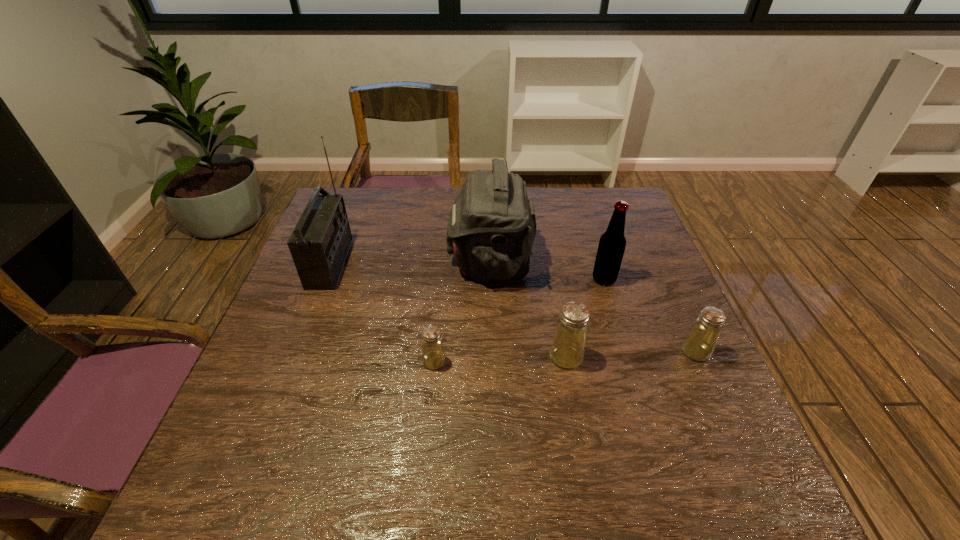
I want to click on beer bottle that is at the right edge, so click(x=612, y=243).

At what (x,y) coordinates should I click in order to perform the action: click on free space at the far edge. Please return your answer as a coordinate pair (x, y). The width and height of the screenshot is (960, 540). Looking at the image, I should click on (542, 222).

Where is `vacant space at the near edge of the desktop`? The height and width of the screenshot is (540, 960). vacant space at the near edge of the desktop is located at coordinates (399, 410).

The width and height of the screenshot is (960, 540). I want to click on vacant area at the left edge, so click(x=300, y=369).

The height and width of the screenshot is (540, 960). What are the coordinates of `vacant space at the right edge` in the screenshot? It's located at (623, 321).

At what (x,y) coordinates should I click in order to perform the action: click on empty space between the radio receiver and the fourth object from left to right. Please return your answer as a coordinate pair (x, y). The width and height of the screenshot is (960, 540). Looking at the image, I should click on (448, 310).

I want to click on free space between the fifth tallest object and the fourth object from left to right, so click(631, 354).

At what (x,y) coordinates should I click in order to perform the action: click on empty location between the second tallest object and the leftmost object. Please return your answer as a coordinate pair (x, y). This screenshot has height=540, width=960. Looking at the image, I should click on (410, 262).

You are a GUI agent. You are given a task and a screenshot of the screen. Output one action in this format:
    pyautogui.click(x=<x>, y=<y>)
    Task: Click on the free space between the rightmost object and the leftmost object
    Image resolution: width=960 pixels, height=540 pixels.
    Given the screenshot: What is the action you would take?
    pyautogui.click(x=513, y=307)

What are the coordinates of `free space between the leftmost saltshaker and the third shortest object` in the screenshot? It's located at (500, 359).